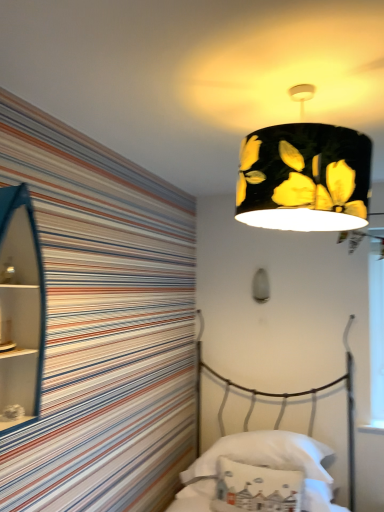
How much space does white fabric pillow at lower center, acting as the first pillow starting from the back, occupy horizontally?

white fabric pillow at lower center, acting as the first pillow starting from the back, is 19.67 inches wide.

What do you see at coordinates (304, 178) in the screenshot?
I see `black matte lampshade at upper center, which is counted as the first lamp, starting from the top` at bounding box center [304, 178].

How much space does black matte lampshade at upper center, which is counted as the first lamp, starting from the top, occupy horizontally?

The width of black matte lampshade at upper center, which is counted as the first lamp, starting from the top, is 16.79 inches.

Describe the element at coordinates (261, 286) in the screenshot. I see `satin white lampshade at upper center, the 2th lamp when ordered from front to back` at that location.

Describe the element at coordinates (376, 335) in the screenshot. I see `transparent plastic window screen at right` at that location.

At what (x,y) coordinates should I click in order to perform the action: click on blue glossy cabinet at left. Please return your answer as a coordinate pair (x, y). This screenshot has width=384, height=512. Looking at the image, I should click on (20, 310).

The height and width of the screenshot is (512, 384). Find the location of `window screen on the right of black matte lampshade at upper center, which ranks as the second lamp in bottom-to-top order`. window screen on the right of black matte lampshade at upper center, which ranks as the second lamp in bottom-to-top order is located at coordinates (376, 335).

Is black matte lampshade at upper center, which ranks as the second lamp in back-to-front order, oriented away from transparent plastic window screen at right?

That's right, black matte lampshade at upper center, which ranks as the second lamp in back-to-front order, is facing away from transparent plastic window screen at right.

Is black matte lampshade at upper center, which is counted as the first lamp, starting from the top, completely or partially outside of transparent plastic window screen at right?

black matte lampshade at upper center, which is counted as the first lamp, starting from the top, lies outside transparent plastic window screen at right's area.

Could you measure the distance between black matte lampshade at upper center, which ranks as the second lamp in bottom-to-top order, and transparent plastic window screen at right?

black matte lampshade at upper center, which ranks as the second lamp in bottom-to-top order, is 4.48 feet away from transparent plastic window screen at right.

Which of these two, white fabric pillow at lower center, the second pillow viewed from the front, or transparent plastic window screen at right, is wider?

white fabric pillow at lower center, the second pillow viewed from the front, is wider.

From a real-world perspective, is white fabric pillow at lower center, acting as the first pillow starting from the back, beneath transparent plastic window screen at right?

Yes.

Is white fabric pillow at lower center, acting as the first pillow starting from the back, at the left side of transparent plastic window screen at right?

Indeed, white fabric pillow at lower center, acting as the first pillow starting from the back, is positioned on the left side of transparent plastic window screen at right.

Between satin white lampshade at upper center, the 2th lamp when ordered from front to back, and white fabric pillow at lower center, the second pillow viewed from the front, which one appears on the right side from the viewer's perspective?

satin white lampshade at upper center, the 2th lamp when ordered from front to back.

From the image's perspective, is satin white lampshade at upper center, the 2th lamp when ordered from front to back, under white fabric pillow at lower center, the second pillow viewed from the front?

Incorrect, from the image's perspective, satin white lampshade at upper center, the 2th lamp when ordered from front to back, is higher than white fabric pillow at lower center, the second pillow viewed from the front.

Is point (253, 295) farther from viewer compared to point (287, 438)?

Yes, it is.

Find the location of a particular element. This screenshot has height=512, width=384. lamp located on the right of white fabric pillow at lower center, the second pillow viewed from the front is located at coordinates (261, 286).

Considering the points (286, 483) and (267, 291), which point is behind, point (286, 483) or point (267, 291)?

The point (267, 291) is farther.

From a real-world perspective, which is physically below, white fabric pillow at lower center, which is the 2th pillow from back to front, or satin white lampshade at upper center, positioned as the 1th lamp in back-to-front order?

Answer: white fabric pillow at lower center, which is the 2th pillow from back to front, is physically lower.

Identify the location of lamp that is behind the white fabric pillow at lower center, which is the 2th pillow from back to front. (261, 286).

Is white fabric pillow at lower center, which is the 2th pillow from back to front, looking in the opposite direction of satin white lampshade at upper center, the 2th lamp positioned from the top?

No, white fabric pillow at lower center, which is the 2th pillow from back to front, is not facing away from satin white lampshade at upper center, the 2th lamp positioned from the top.

Could you tell me if satin white lampshade at upper center, the 2th lamp positioned from the top, is facing black matte lampshade at upper center, which ranks as the second lamp in bottom-to-top order?

Yes, satin white lampshade at upper center, the 2th lamp positioned from the top, is aimed at black matte lampshade at upper center, which ranks as the second lamp in bottom-to-top order.

From a real-world perspective, between satin white lampshade at upper center, positioned as the 1th lamp in back-to-front order, and black matte lampshade at upper center, which ranks as the second lamp in bottom-to-top order, who is vertically higher?

In real-world perspective, black matte lampshade at upper center, which ranks as the second lamp in bottom-to-top order, is above.

Does satin white lampshade at upper center, the 2th lamp when ordered from front to back, lie behind black matte lampshade at upper center, which is counted as the first lamp, starting from the top?

Yes, satin white lampshade at upper center, the 2th lamp when ordered from front to back, is behind black matte lampshade at upper center, which is counted as the first lamp, starting from the top.

Considering the positions of objects satin white lampshade at upper center, positioned as the 1th lamp in back-to-front order, and black matte lampshade at upper center, which ranks as the second lamp in bottom-to-top order, in the image provided, who is more to the right, satin white lampshade at upper center, positioned as the 1th lamp in back-to-front order, or black matte lampshade at upper center, which ranks as the second lamp in bottom-to-top order,?

Positioned to the right is satin white lampshade at upper center, positioned as the 1th lamp in back-to-front order.

Is transparent plastic window screen at right touching blue glossy cabinet at left?

No, transparent plastic window screen at right is not touching blue glossy cabinet at left.

From the image's perspective, which object appears higher, transparent plastic window screen at right or blue glossy cabinet at left?

From the image's view, blue glossy cabinet at left is above.

From a real-world perspective, is transparent plastic window screen at right located beneath blue glossy cabinet at left?

Yes.

From the image's perspective, is black matte lampshade at upper center, arranged as the 1th lamp when viewed from the front, above satin white lampshade at upper center, positioned as the 1th lamp in back-to-front order?

Indeed, from the image's perspective, black matte lampshade at upper center, arranged as the 1th lamp when viewed from the front, is shown above satin white lampshade at upper center, positioned as the 1th lamp in back-to-front order.

Considering the relative positions of black matte lampshade at upper center, which ranks as the second lamp in back-to-front order, and satin white lampshade at upper center, the 2th lamp positioned from the top, in the image provided, is black matte lampshade at upper center, which ranks as the second lamp in back-to-front order, to the left or to the right of satin white lampshade at upper center, the 2th lamp positioned from the top,?

Clearly, black matte lampshade at upper center, which ranks as the second lamp in back-to-front order, is on the left of satin white lampshade at upper center, the 2th lamp positioned from the top, in the image.

Looking at this image, from a real-world perspective, is black matte lampshade at upper center, arranged as the 1th lamp when viewed from the front, positioned over satin white lampshade at upper center, which appears as the 1th lamp when ordered from the bottom, based on gravity?

Yes, from a real-world perspective, black matte lampshade at upper center, arranged as the 1th lamp when viewed from the front, is on top of satin white lampshade at upper center, which appears as the 1th lamp when ordered from the bottom.

At what (x,y) coordinates should I click in order to perform the action: click on window screen below the black matte lampshade at upper center, which is counted as the first lamp, starting from the top (from the image's perspective). Please return your answer as a coordinate pair (x, y). This screenshot has width=384, height=512. Looking at the image, I should click on tap(376, 335).

In order to click on the 1st pillow to the left of the transparent plastic window screen at right, counting from the anchor's position in this screenshot , I will do `click(264, 454)`.

From the picture: From the image, which object appears to be nearer to blue glossy cabinet at left, satin white lampshade at upper center, the 2th lamp when ordered from front to back, or transparent plastic window screen at right?

satin white lampshade at upper center, the 2th lamp when ordered from front to back, is closer to blue glossy cabinet at left.

Looking at the image, which one is located closer to transparent plastic window screen at right, white fabric pillow at lower center, which is the 1th pillow in front-to-back order, or satin white lampshade at upper center, positioned as the 1th lamp in back-to-front order?

satin white lampshade at upper center, positioned as the 1th lamp in back-to-front order.

Which object lies nearer to the anchor point white fabric pillow at lower center, which is the 2th pillow from back to front, satin white lampshade at upper center, the 2th lamp when ordered from front to back, or transparent plastic window screen at right?

Based on the image, transparent plastic window screen at right appears to be nearer to white fabric pillow at lower center, which is the 2th pillow from back to front.

Which object lies nearer to the anchor point blue glossy cabinet at left, satin white lampshade at upper center, the 2th lamp positioned from the top, or black matte lampshade at upper center, which ranks as the second lamp in bottom-to-top order?

The object closer to blue glossy cabinet at left is black matte lampshade at upper center, which ranks as the second lamp in bottom-to-top order.

Which object lies nearer to the anchor point satin white lampshade at upper center, the 2th lamp when ordered from front to back, black matte lampshade at upper center, which is counted as the first lamp, starting from the top, or transparent plastic window screen at right?

Based on the image, transparent plastic window screen at right appears to be nearer to satin white lampshade at upper center, the 2th lamp when ordered from front to back.

Considering their positions, is black matte lampshade at upper center, which ranks as the second lamp in back-to-front order, positioned closer to white fabric pillow at lower center, acting as the first pillow starting from the back, than white fabric pillow at lower center, which is the 2th pillow from back to front?

white fabric pillow at lower center, which is the 2th pillow from back to front, is closer to white fabric pillow at lower center, acting as the first pillow starting from the back.

Which object lies further to the anchor point white fabric pillow at lower center, the second pillow viewed from the front, transparent plastic window screen at right or blue glossy cabinet at left?

The object further to white fabric pillow at lower center, the second pillow viewed from the front, is blue glossy cabinet at left.

Considering their positions, is transparent plastic window screen at right positioned closer to white fabric pillow at lower center, which is the 1th pillow in front-to-back order, than black matte lampshade at upper center, which ranks as the second lamp in back-to-front order?

transparent plastic window screen at right.

Find the location of a particular element. The height and width of the screenshot is (512, 384). pillow between blue glossy cabinet at left and white fabric pillow at lower center, the second pillow viewed from the front, vertically is located at coordinates (256, 488).

Where is `window screen between black matte lampshade at upper center, which ranks as the second lamp in back-to-front order, and white fabric pillow at lower center, which is the 2th pillow from back to front, from top to bottom`? This screenshot has width=384, height=512. window screen between black matte lampshade at upper center, which ranks as the second lamp in back-to-front order, and white fabric pillow at lower center, which is the 2th pillow from back to front, from top to bottom is located at coordinates (376, 335).

Find the location of a particular element. The height and width of the screenshot is (512, 384). window screen between black matte lampshade at upper center, which ranks as the second lamp in bottom-to-top order, and satin white lampshade at upper center, the 2th lamp when ordered from front to back, from front to back is located at coordinates (376, 335).

Locate an element on the screen. The width and height of the screenshot is (384, 512). cabinet between black matte lampshade at upper center, which ranks as the second lamp in back-to-front order, and white fabric pillow at lower center, the second pillow viewed from the front, vertically is located at coordinates (20, 310).